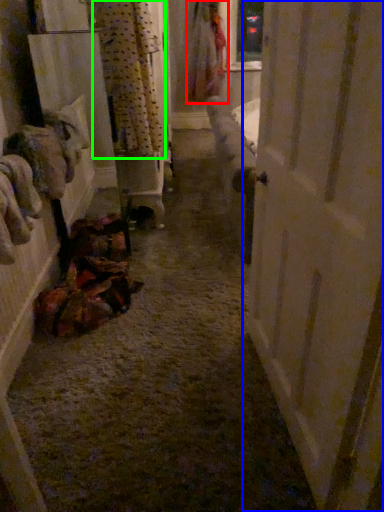
Question: Which object is the closest to the clothing (highlighted by a red box)? Choose among these: door (highlighted by a blue box) or curtain (highlighted by a green box).

Choices:
 (A) door
 (B) curtain

Answer: (B)